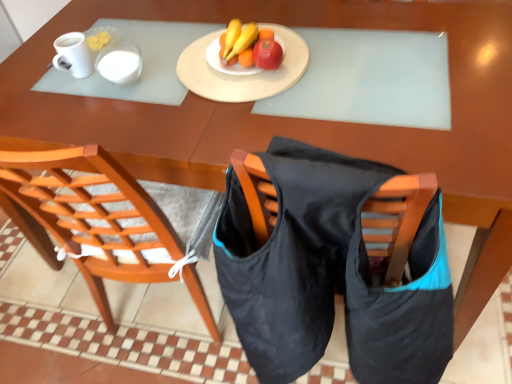
Question: Considering the positions of white glossy mug at upper left and matte yellow banana at center in the image, is white glossy mug at upper left wider or thinner than matte yellow banana at center?

Choices:
 (A) thin
 (B) wide

Answer: (A)

Question: Relative to matte yellow banana at center, is white glossy mug at upper left in front or behind?

Choices:
 (A) front
 (B) behind

Answer: (A)

Question: Which object is positioned farthest from the white glossy mug at upper left?

Choices:
 (A) matte red apple at center
 (B) matte yellow banana at center
 (C) wooden chair at center
 (D) white glossy mug at upper left
 (E) matte white plate at center

Answer: (C)

Question: Estimate the real-world distances between objects in this image. Which object is farther from the wooden chair at center?

Choices:
 (A) white glossy mug at upper left
 (B) matte white plate at center
 (C) white glossy mug at upper left
 (D) matte yellow banana at center
 (E) matte red apple at center

Answer: (E)